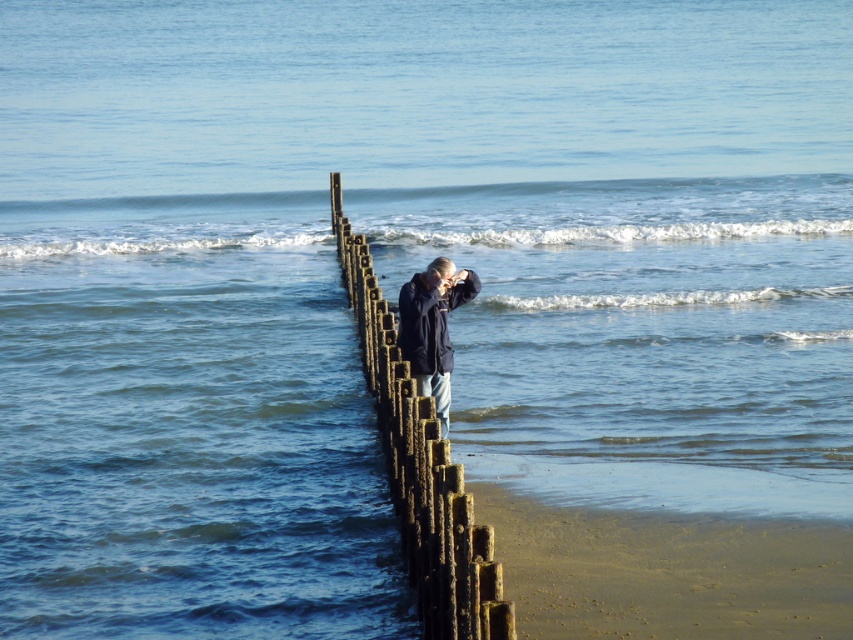
You are standing on the wooden breakwater and want to move closer to the ocean. There is a wooden post at center and a dark blue jacket at center in your path. Which object should you step around to avoid them?

You should step around the wooden post at center because it is to the left of the dark blue jacket at center, so moving to the right side of the dark blue jacket at center would allow you to bypass both objects safely.

You are standing on the wooden breakwater and want to ensure you can safely pass between the wooden post at center and the dark blue jacket at center. Given that the space between them is narrow, can you walk through without touching either?

The wooden post at center is taller than the dark blue jacket at center, but the description does not provide information about the horizontal distance between them. Therefore, it is uncertain whether there is enough space to walk through without touching either object.